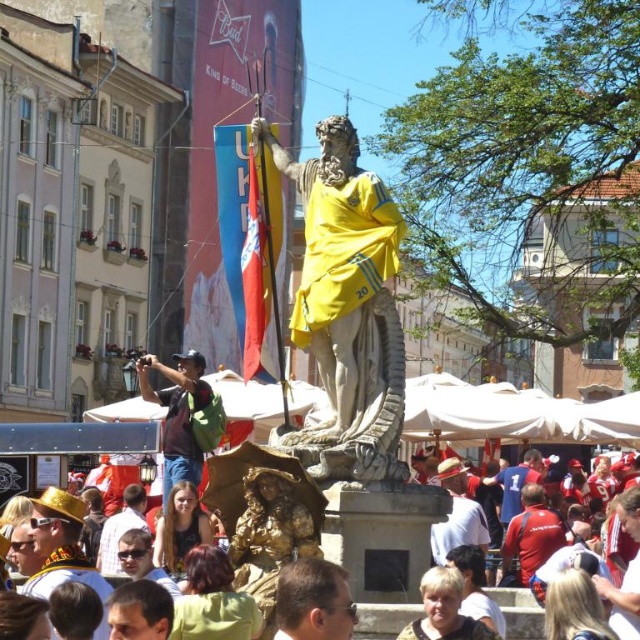
Question: Which is nearer to the white cotton shirt at center?

Choices:
 (A) gold textured statue at center
 (B) red fabric jacket at center

Answer: (B)

Question: Is red fabric shirt at center further to camera compared to red shirt at center?

Choices:
 (A) no
 (B) yes

Answer: (A)

Question: Which of the following is the closest to the observer?

Choices:
 (A) (525, 449)
 (B) (515, 609)
 (C) (237, 300)

Answer: (B)

Question: Does light brown leather jacket at lower center have a larger size compared to red shirt at center?

Choices:
 (A) yes
 (B) no

Answer: (A)

Question: Which point is closer to the camera?

Choices:
 (A) (317, 625)
 (B) (358, 152)
 (C) (273, 195)

Answer: (A)

Question: Is light brown leather jacket at lower center wider than gold textured statue at center?

Choices:
 (A) no
 (B) yes

Answer: (A)